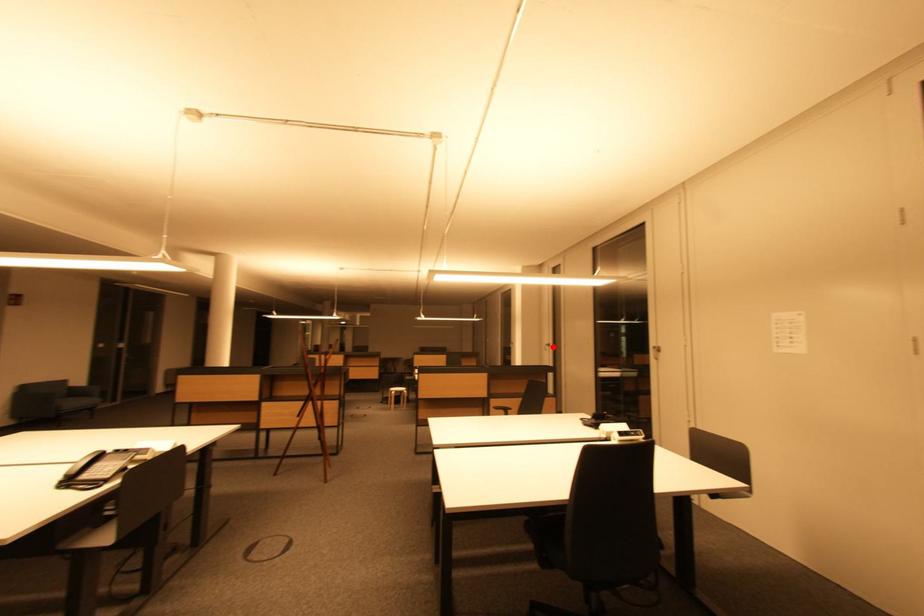
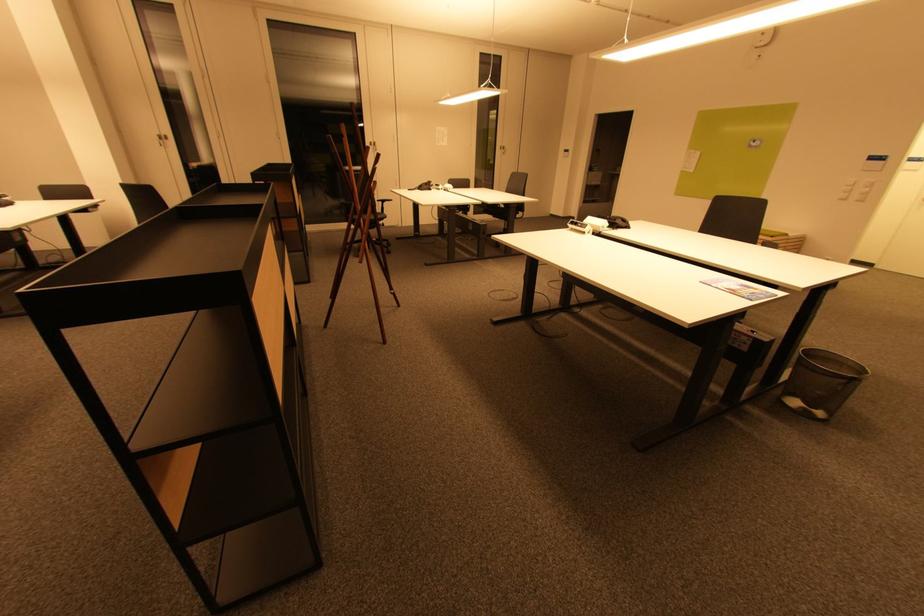
Find the pixel in the second image that matches the highlighted location in the first image.

(166, 140)